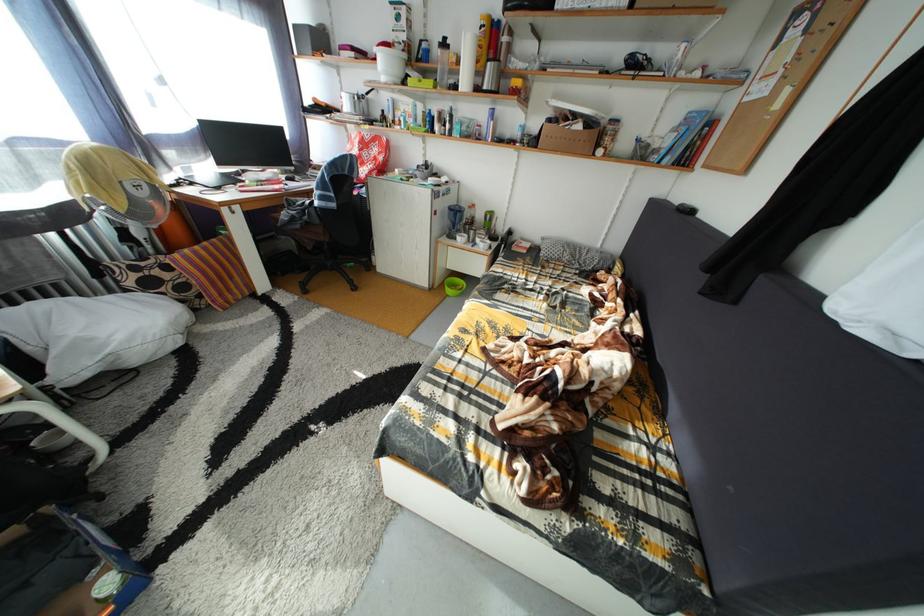
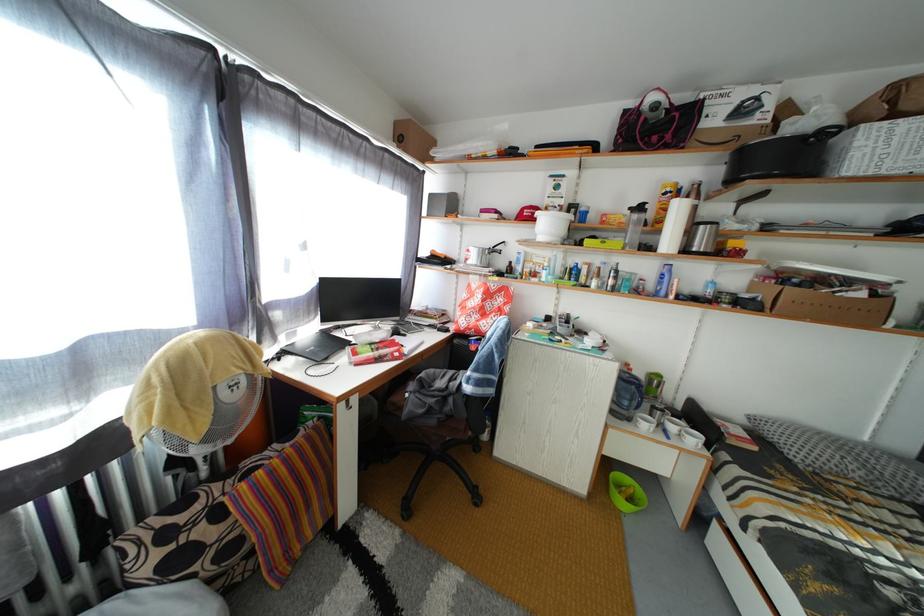
The images are taken continuously from a first-person perspective. In which direction are you moving?

The cameraman moved toward left, forward.